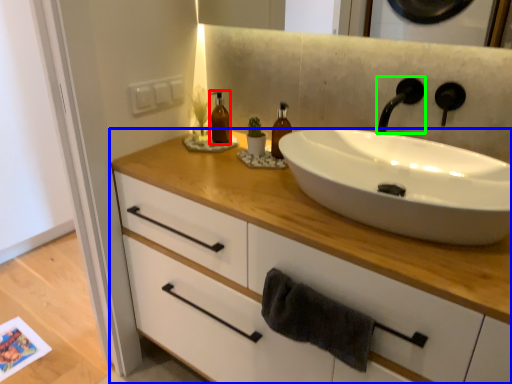
Question: Which object is the farthest from bottle (highlighted by a red box)? Choose among these: bathroom cabinet (highlighted by a blue box) or tap (highlighted by a green box).

Choices:
 (A) bathroom cabinet
 (B) tap

Answer: (B)